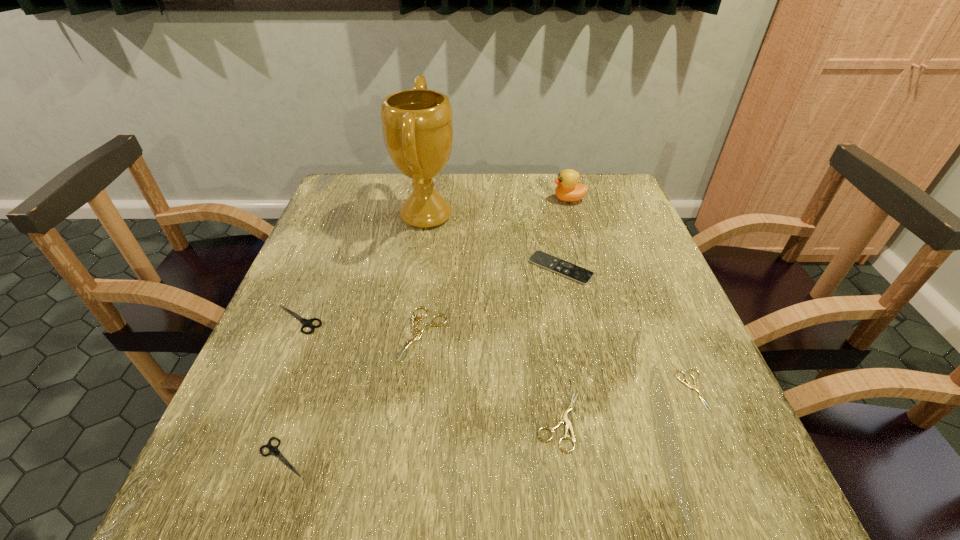
Where is `the shortest shears`? This screenshot has width=960, height=540. the shortest shears is located at coordinates (695, 387).

I want to click on the rightmost shears, so click(695, 387).

I want to click on vacant space located on the front of the tallest object with the decoration, so click(500, 215).

You are a GUI agent. You are given a task and a screenshot of the screen. Output one action in this format:
    pyautogui.click(x=<x>, y=<y>)
    Task: Click on the vacant space situated 0.150m on the face of the yellow duckling
    The height and width of the screenshot is (540, 960).
    Given the screenshot: What is the action you would take?
    pyautogui.click(x=501, y=199)

Image resolution: width=960 pixels, height=540 pixels. In order to click on vacant space located 0.140m on the face of the yellow duckling in this screenshot , I will do `click(504, 199)`.

Where is `vacant space situated 0.130m on the face of the yellow duckling`? This screenshot has width=960, height=540. vacant space situated 0.130m on the face of the yellow duckling is located at coordinates (508, 199).

Find the location of a particular element. free spot located on the front of the sixth shortest object is located at coordinates (575, 339).

This screenshot has height=540, width=960. In order to click on free location located on the front of the farther black shears in this screenshot , I will do `click(277, 371)`.

I want to click on blank space located on the left of the leftmost beige shears, so click(287, 334).

The height and width of the screenshot is (540, 960). What are the coordinates of `vacant space located on the front of the second biggest beige shears` in the screenshot? It's located at (574, 519).